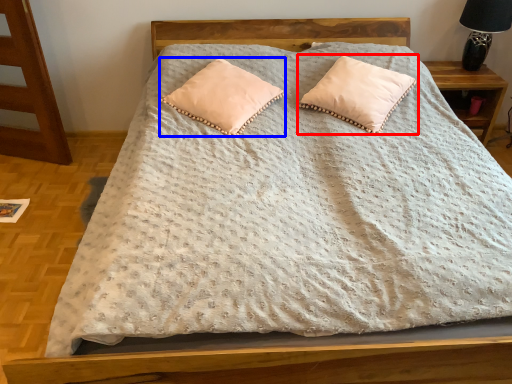
Question: Among these objects, which one is farthest to the camera, pillow (highlighted by a red box) or pillow (highlighted by a blue box)?

Choices:
 (A) pillow
 (B) pillow

Answer: (A)